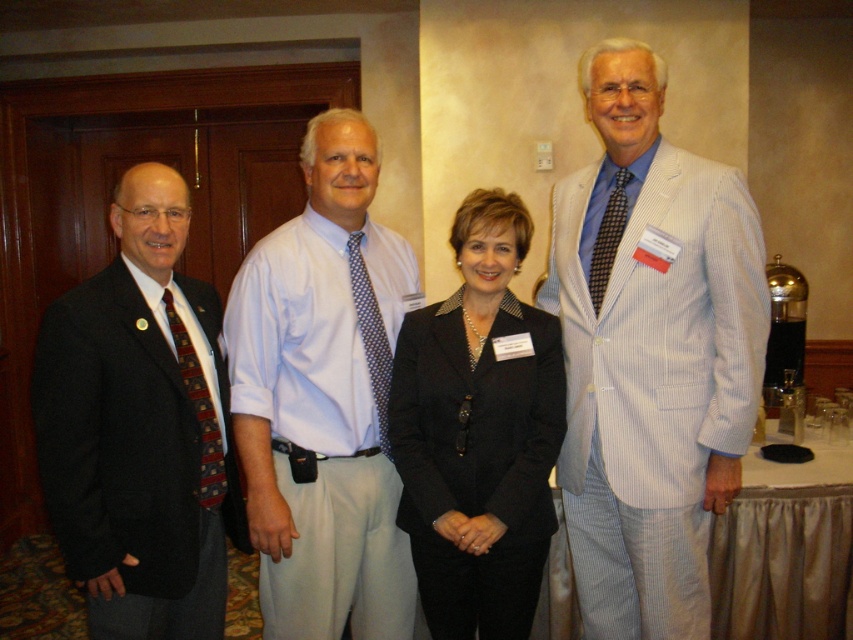
Which is behind, point (706, 600) or point (378, 264)?

Positioned behind is point (378, 264).

Who is more forward, (722,298) or (328,264)?

Point (722,298)

Which is behind, point (683, 340) or point (312, 378)?

Positioned behind is point (312, 378).

Locate an element on the screen. white striped suit at center is located at coordinates (651, 353).

Measure the distance between black fabric suit at center and camera.

black fabric suit at center and camera are 5.89 feet apart.

From the picture: Who is lower down, black fabric suit at center or red plaid tie at left?

black fabric suit at center is below.

Who is more forward, (x=416, y=323) or (x=202, y=378)?

Point (x=202, y=378)

I want to click on black fabric suit at center, so click(x=479, y=433).

Does point (666, 168) come farther from viewer compared to point (543, 550)?

No, it is in front of (543, 550).

Who is taller, white striped suit at center or black fabric suit at center?

white striped suit at center

Is point (656, 113) positioned behind point (440, 477)?

No, (656, 113) is in front of (440, 477).

At what (x,y) coordinates should I click in order to perform the action: click on white striped suit at center. Please return your answer as a coordinate pair (x, y). The image size is (853, 640). Looking at the image, I should click on (651, 353).